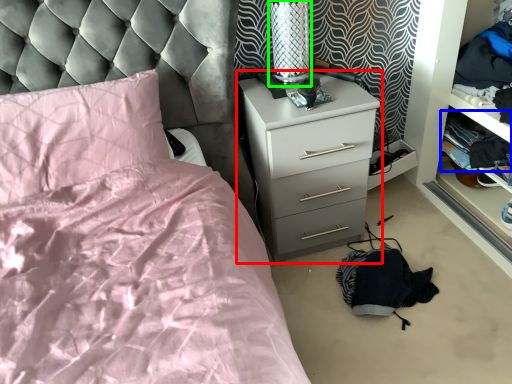
Question: Which is farther away from chest of drawers (highlighted by a red box)? clothing (highlighted by a blue box) or table lamp (highlighted by a green box)?

Choices:
 (A) clothing
 (B) table lamp

Answer: (A)